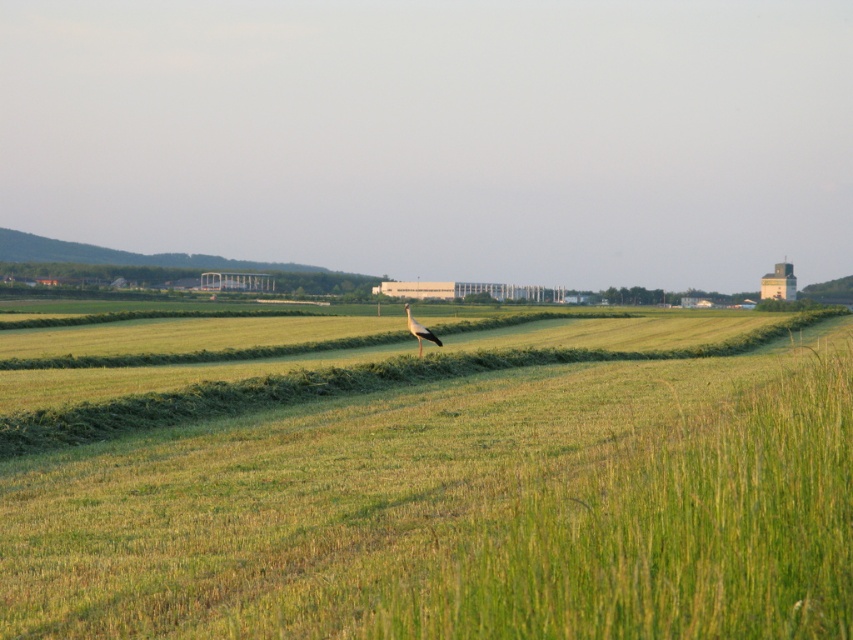
Question: Is green grassy field at center thinner than white feathered bird at center?

Choices:
 (A) no
 (B) yes

Answer: (A)

Question: Which point appears closest to the camera in this image?

Choices:
 (A) (405, 310)
 (B) (608, 492)

Answer: (B)

Question: Can you confirm if green grassy field at center is smaller than white feathered bird at center?

Choices:
 (A) yes
 (B) no

Answer: (B)

Question: Among these objects, which one is farthest from the camera?

Choices:
 (A) green grassy field at center
 (B) white feathered bird at center

Answer: (B)

Question: In this image, where is green grassy field at center located relative to white feathered bird at center?

Choices:
 (A) above
 (B) below

Answer: (B)

Question: Among these objects, which one is farthest from the camera?

Choices:
 (A) white feathered bird at center
 (B) green grassy field at center

Answer: (A)